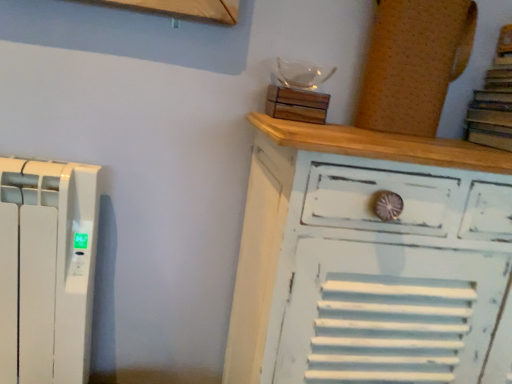
Question: Based on their sizes in the image, would you say wooden block at upper center, positioned as the 2th wood in right-to-left order, is bigger or smaller than white distressed wood chest of drawers at upper right?

Choices:
 (A) big
 (B) small

Answer: (B)

Question: Considering the relative positions of wooden block at upper center, which is counted as the 1th wood, starting from the left, and white distressed wood chest of drawers at upper right in the image provided, is wooden block at upper center, which is counted as the 1th wood, starting from the left, to the left or to the right of white distressed wood chest of drawers at upper right?

Choices:
 (A) left
 (B) right

Answer: (A)

Question: Which object is positioned farthest from the white distressed wood chest of drawers at upper right?

Choices:
 (A) brown paper book at upper right
 (B) wooden block at upper center, positioned as the 2th wood in right-to-left order
 (C) cork board at upper right, the second wood when ordered from left to right

Answer: (A)

Question: Which object is the farthest from the brown paper book at upper right?

Choices:
 (A) white distressed wood chest of drawers at upper right
 (B) cork board at upper right, which is the first wood from right to left
 (C) wooden block at upper center, positioned as the 2th wood in right-to-left order

Answer: (A)